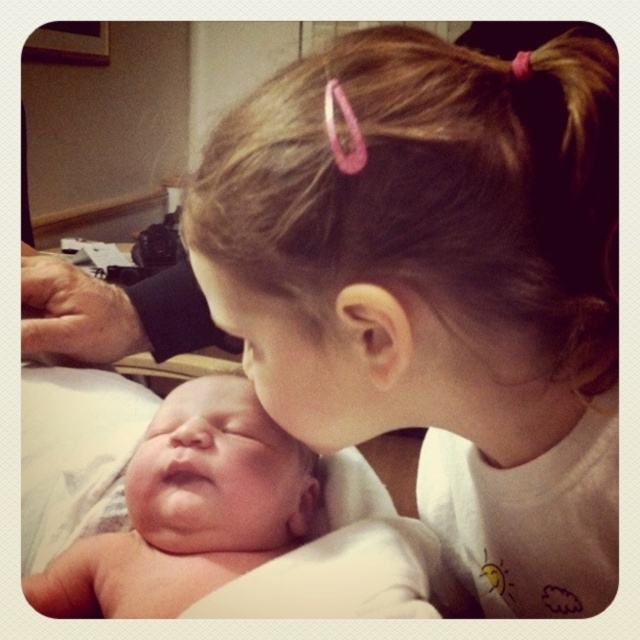
Question: In this image, where is white soft hair at upper center located relative to pink skin newborn at lower left?

Choices:
 (A) right
 (B) left

Answer: (A)

Question: Can you confirm if white soft hair at upper center is positioned above pink skin newborn at lower left?

Choices:
 (A) yes
 (B) no

Answer: (A)

Question: Among these points, which one is nearest to the camera?

Choices:
 (A) (280, 547)
 (B) (570, 282)

Answer: (B)

Question: Which of the following is the closest to the observer?

Choices:
 (A) white soft hair at upper center
 (B) pink skin newborn at lower left

Answer: (A)

Question: Does white soft hair at upper center appear on the left side of pink skin newborn at lower left?

Choices:
 (A) no
 (B) yes

Answer: (A)

Question: Among these objects, which one is nearest to the camera?

Choices:
 (A) white soft hair at upper center
 (B) pink skin newborn at lower left

Answer: (A)